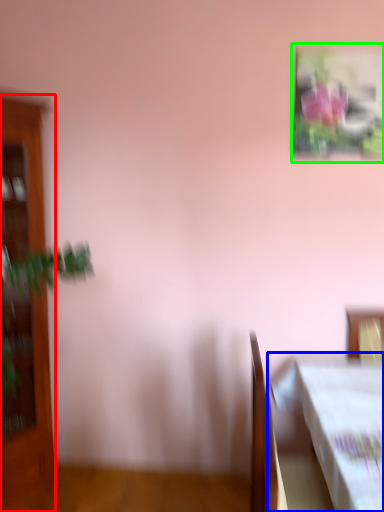
Question: Considering the real-world distances, which object is closest to furniture (highlighted by a red box)? table (highlighted by a blue box) or picture frame (highlighted by a green box).

Choices:
 (A) table
 (B) picture frame

Answer: (A)